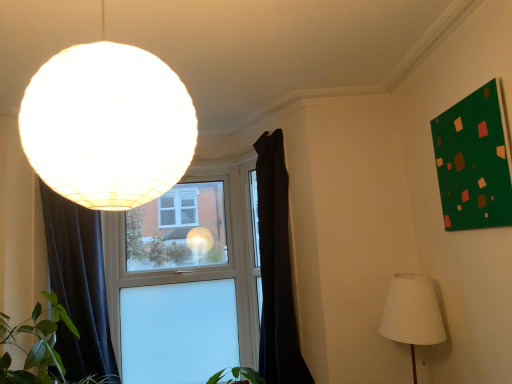
What do you see at coordinates (412, 314) in the screenshot? I see `white fabric lampshade at lower right, the first lamp when ordered from back to front` at bounding box center [412, 314].

Find the location of a particular element. This screenshot has width=512, height=384. white fabric lampshade at lower right, the second lamp from the left is located at coordinates (412, 314).

Where is `dark fabric curtain at left, which is the first curtain in left-to-right order`? The width and height of the screenshot is (512, 384). dark fabric curtain at left, which is the first curtain in left-to-right order is located at coordinates (x=79, y=286).

Image resolution: width=512 pixels, height=384 pixels. In order to click on dark fabric curtain at center, which is the 2th curtain in left-to-right order in this screenshot , I will do `click(276, 268)`.

Image resolution: width=512 pixels, height=384 pixels. What do you see at coordinates (184, 274) in the screenshot? I see `transparent glass window at center` at bounding box center [184, 274].

What do you see at coordinates (108, 126) in the screenshot? I see `matte white globe at upper left, acting as the second lamp starting from the bottom` at bounding box center [108, 126].

The height and width of the screenshot is (384, 512). What are the coordinates of `green matte board at upper right` in the screenshot? It's located at (474, 161).

Is dark fabric curtain at center, which is the 2th curtain in left-to-right order, aimed at white fabric lampshade at lower right, the second lamp from the left?

No, dark fabric curtain at center, which is the 2th curtain in left-to-right order, is not facing towards white fabric lampshade at lower right, the second lamp from the left.

Based on the photo, from a real-world perspective, between dark fabric curtain at center, which is the 2th curtain in left-to-right order, and white fabric lampshade at lower right, the 2th lamp in the top-to-bottom sequence, who is vertically higher?

dark fabric curtain at center, which is the 2th curtain in left-to-right order, from a real-world perspective.

What's the angular difference between dark fabric curtain at center, which is the 1th curtain in right-to-left order, and white fabric lampshade at lower right, marked as the first lamp in a right-to-left arrangement,'s facing directions?

32.3 degrees.

Considering the points (276, 174) and (415, 330), which point is behind, point (276, 174) or point (415, 330)?

Point (276, 174)

How different are the orientations of matte white globe at upper left, which ranks as the 1th lamp in top-to-bottom order, and dark fabric curtain at center, which is the 1th curtain in right-to-left order, in degrees?

The angular difference between matte white globe at upper left, which ranks as the 1th lamp in top-to-bottom order, and dark fabric curtain at center, which is the 1th curtain in right-to-left order, is 122 degrees.

Is dark fabric curtain at center, which is the 2th curtain in left-to-right order, completely or partially inside matte white globe at upper left, the 1th lamp positioned from the front?

No.

Considering the sizes of objects matte white globe at upper left, positioned as the 2th lamp in right-to-left order, and dark fabric curtain at center, which is the 1th curtain in right-to-left order, in the image provided, who is shorter, matte white globe at upper left, positioned as the 2th lamp in right-to-left order, or dark fabric curtain at center, which is the 1th curtain in right-to-left order,?

Standing shorter between the two is matte white globe at upper left, positioned as the 2th lamp in right-to-left order.

Is matte white globe at upper left, which ranks as the 1th lamp in top-to-bottom order, positioned with its back to dark fabric curtain at center, which is the 2th curtain in left-to-right order?

matte white globe at upper left, which ranks as the 1th lamp in top-to-bottom order, is not turned away from dark fabric curtain at center, which is the 2th curtain in left-to-right order.

Is dark fabric curtain at center, which is the 1th curtain in right-to-left order, to the right of green matte board at upper right from the viewer's perspective?

Incorrect, dark fabric curtain at center, which is the 1th curtain in right-to-left order, is not on the right side of green matte board at upper right.

Could you tell me if dark fabric curtain at center, which is the 2th curtain in left-to-right order, is turned towards green matte board at upper right?

No, dark fabric curtain at center, which is the 2th curtain in left-to-right order, is not aimed at green matte board at upper right.

Between dark fabric curtain at center, which is the 2th curtain in left-to-right order, and green matte board at upper right, which one is positioned in front?

green matte board at upper right is more forward.

From the image's perspective, is dark fabric curtain at center, which is the 2th curtain in left-to-right order, on green matte board at upper right?

Actually, dark fabric curtain at center, which is the 2th curtain in left-to-right order, appears below green matte board at upper right in the image.

From the image's perspective, does dark fabric curtain at left, which is the first curtain in left-to-right order, appear lower than green matte board at upper right?

Indeed, from the image's perspective, dark fabric curtain at left, which is the first curtain in left-to-right order, is shown beneath green matte board at upper right.

Is dark fabric curtain at left, positioned as the second curtain in right-to-left order, positioned with its back to green matte board at upper right?

No, dark fabric curtain at left, positioned as the second curtain in right-to-left order,'s orientation is not away from green matte board at upper right.

Does dark fabric curtain at left, positioned as the second curtain in right-to-left order, have a greater height compared to green matte board at upper right?

Yes.

Is dark fabric curtain at left, positioned as the second curtain in right-to-left order, not close to transparent glass window at center?

dark fabric curtain at left, positioned as the second curtain in right-to-left order, is near transparent glass window at center, not far away.

Is dark fabric curtain at left, which is the first curtain in left-to-right order, taller or shorter than transparent glass window at center?

Considering their sizes, dark fabric curtain at left, which is the first curtain in left-to-right order, has less height than transparent glass window at center.

Is dark fabric curtain at left, positioned as the second curtain in right-to-left order, completely or partially outside of transparent glass window at center?

Yes, dark fabric curtain at left, positioned as the second curtain in right-to-left order, is outside of transparent glass window at center.

Could you measure the distance between dark fabric curtain at left, which is the first curtain in left-to-right order, and transparent glass window at center?

dark fabric curtain at left, which is the first curtain in left-to-right order, and transparent glass window at center are 21.64 inches apart from each other.

Locate an element on the screen. The width and height of the screenshot is (512, 384). lamp directly beneath the matte white globe at upper left, which ranks as the 1th lamp in top-to-bottom order (from a real-world perspective) is located at coordinates (412, 314).

Between matte white globe at upper left, the 1th lamp positioned from the front, and white fabric lampshade at lower right, the 2th lamp in the top-to-bottom sequence, which one has more height?

With more height is white fabric lampshade at lower right, the 2th lamp in the top-to-bottom sequence.

Is there a large distance between matte white globe at upper left, the 1th lamp positioned from the front, and white fabric lampshade at lower right, acting as the first lamp starting from the bottom?

Yes.

From the image's perspective, does matte white globe at upper left, which ranks as the 1th lamp in top-to-bottom order, appear lower than white fabric lampshade at lower right, placed as the second lamp when sorted from front to back?

Actually, matte white globe at upper left, which ranks as the 1th lamp in top-to-bottom order, appears above white fabric lampshade at lower right, placed as the second lamp when sorted from front to back, in the image.

Looking at this image, which object is closer to the camera taking this photo, green matte board at upper right or dark fabric curtain at center, which is the 1th curtain in right-to-left order?

green matte board at upper right is more forward.

From the image's perspective, between green matte board at upper right and dark fabric curtain at center, which is the 2th curtain in left-to-right order, who is located below?

dark fabric curtain at center, which is the 2th curtain in left-to-right order.

Which object is wider, green matte board at upper right or dark fabric curtain at center, which is the 1th curtain in right-to-left order?

With larger width is dark fabric curtain at center, which is the 1th curtain in right-to-left order.

From the image's perspective, which curtain is the 2nd one above the white fabric lampshade at lower right, marked as the first lamp in a right-to-left arrangement? Please provide its 2D coordinates.

[(276, 268)]

You are a GUI agent. You are given a task and a screenshot of the screen. Output one action in this format:
    pyautogui.click(x=<x>, y=<y>)
    Task: Click on the 2nd lamp in front of the dark fabric curtain at center, which is the 2th curtain in left-to-right order, counting from the anchor's position
    The image size is (512, 384).
    Given the screenshot: What is the action you would take?
    pyautogui.click(x=108, y=126)

Considering their positions, is matte white globe at upper left, acting as the second lamp starting from the bottom, positioned further to dark fabric curtain at center, which is the 2th curtain in left-to-right order, than dark fabric curtain at left, which is the first curtain in left-to-right order?

The object further to dark fabric curtain at center, which is the 2th curtain in left-to-right order, is matte white globe at upper left, acting as the second lamp starting from the bottom.

Looking at this image, when comparing their distances from green matte board at upper right, does transparent glass window at center or dark fabric curtain at center, which is the 1th curtain in right-to-left order, seem closer?

dark fabric curtain at center, which is the 1th curtain in right-to-left order, is closer to green matte board at upper right.

When comparing their distances from green matte board at upper right, does dark fabric curtain at center, which is the 1th curtain in right-to-left order, or white fabric lampshade at lower right, the second lamp from the left, seem closer?

Among the two, white fabric lampshade at lower right, the second lamp from the left, is located nearer to green matte board at upper right.

Which object lies further to the anchor point green matte board at upper right, white fabric lampshade at lower right, the 2th lamp in the top-to-bottom sequence, or matte white globe at upper left, acting as the second lamp starting from the bottom?

matte white globe at upper left, acting as the second lamp starting from the bottom, is further to green matte board at upper right.

Based on their spatial positions, is dark fabric curtain at center, which is the 2th curtain in left-to-right order, or matte white globe at upper left, arranged as the 1th lamp when viewed from the left, further from dark fabric curtain at left, positioned as the second curtain in right-to-left order?

Based on the image, matte white globe at upper left, arranged as the 1th lamp when viewed from the left, appears to be further to dark fabric curtain at left, positioned as the second curtain in right-to-left order.

Which object lies nearer to the anchor point green matte board at upper right, white fabric lampshade at lower right, the 2th lamp in the top-to-bottom sequence, or dark fabric curtain at center, which is the 1th curtain in right-to-left order?

white fabric lampshade at lower right, the 2th lamp in the top-to-bottom sequence, lies closer to green matte board at upper right than the other object.

Estimate the real-world distances between objects in this image. Which object is closer to white fabric lampshade at lower right, acting as the first lamp starting from the bottom, transparent glass window at center or dark fabric curtain at center, which is the 2th curtain in left-to-right order?

dark fabric curtain at center, which is the 2th curtain in left-to-right order, is closer to white fabric lampshade at lower right, acting as the first lamp starting from the bottom.

Consider the image. Considering their positions, is dark fabric curtain at center, which is the 1th curtain in right-to-left order, positioned further to transparent glass window at center than matte white globe at upper left, the 1th lamp positioned from the front?

Among the two, matte white globe at upper left, the 1th lamp positioned from the front, is located further to transparent glass window at center.

Where is `window located between dark fabric curtain at left, positioned as the second curtain in right-to-left order, and white fabric lampshade at lower right, the second lamp from the left, in the left-right direction`? window located between dark fabric curtain at left, positioned as the second curtain in right-to-left order, and white fabric lampshade at lower right, the second lamp from the left, in the left-right direction is located at coordinates (184, 274).

Locate an element on the screen. lamp between matte white globe at upper left, positioned as the 2th lamp in right-to-left order, and dark fabric curtain at center, which is the 2th curtain in left-to-right order, from front to back is located at coordinates coord(412,314).

At what (x,y) coordinates should I click in order to perform the action: click on bulletin board between matte white globe at upper left, acting as the second lamp starting from the bottom, and transparent glass window at center from front to back. Please return your answer as a coordinate pair (x, y). Looking at the image, I should click on (474, 161).

Identify the location of curtain located between matte white globe at upper left, which ranks as the 1th lamp in top-to-bottom order, and dark fabric curtain at center, which is the 2th curtain in left-to-right order, in the depth direction. (79, 286).